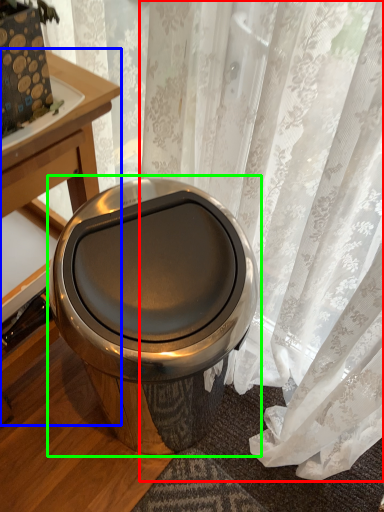
Question: Which object is positioned farthest from curtain (highlighted by a red box)? Select from table (highlighted by a blue box) and toilet (highlighted by a green box).

Choices:
 (A) table
 (B) toilet

Answer: (A)